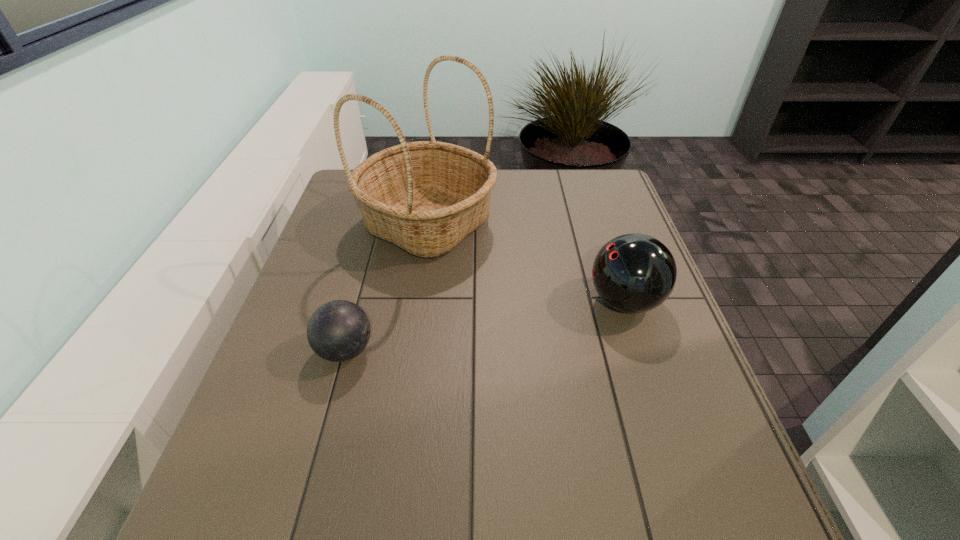
Image resolution: width=960 pixels, height=540 pixels. In order to click on object that is the second closest to the rightmost object in this screenshot , I will do `click(339, 330)`.

Identify which object is the second closest to the right bowling ball. Please provide its 2D coordinates. Your answer should be formatted as a tuple, i.e. [(x, y)], where the tuple contains the x and y coordinates of a point satisfying the conditions above.

[(339, 330)]

You are a GUI agent. You are given a task and a screenshot of the screen. Output one action in this format:
    pyautogui.click(x=<x>, y=<y>)
    Task: Click on the vacant area that satisfies the following two spatial constraints: 1. on the front side of the basket; 2. on the grip area of the shortest object
    This screenshot has height=540, width=960.
    Given the screenshot: What is the action you would take?
    pyautogui.click(x=410, y=350)

The width and height of the screenshot is (960, 540). In order to click on free space in the image that satisfies the following two spatial constraints: 1. on the front side of the basket; 2. on the grip area of the shortest object in this screenshot , I will do `click(410, 350)`.